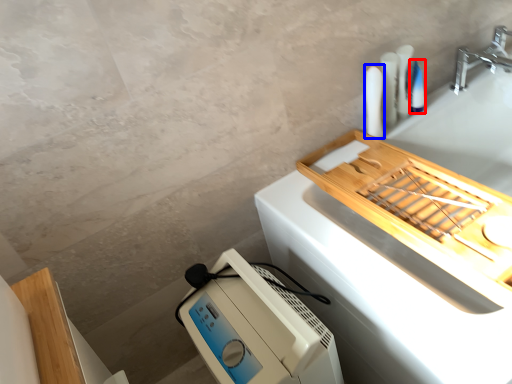
Question: Among these objects, which one is farthest to the camera, toiletry (highlighted by a red box) or toiletry (highlighted by a blue box)?

Choices:
 (A) toiletry
 (B) toiletry

Answer: (A)